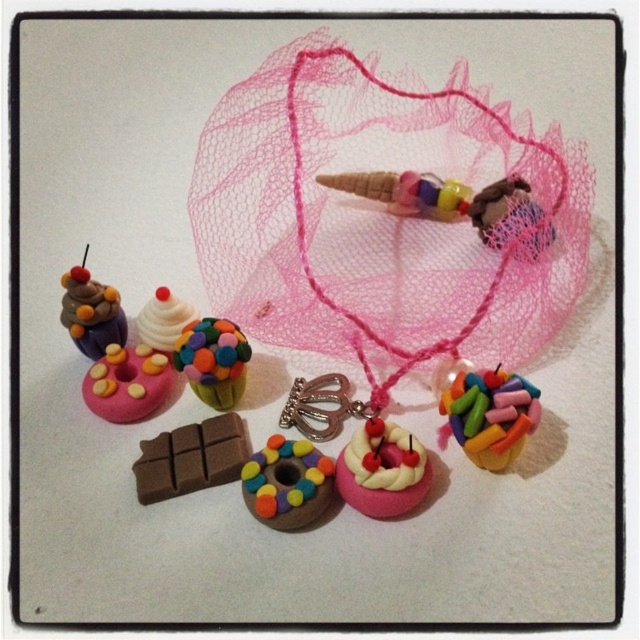
Question: Which object is farther from the camera taking this photo?

Choices:
 (A) matte brown donut at center
 (B) brown matte chocolate bar at lower left

Answer: (B)

Question: Can you confirm if matte brown donut at center is positioned to the right of matte chocolate cupcake at left?

Choices:
 (A) no
 (B) yes

Answer: (B)

Question: Is brown matte chocolate bar at lower left behind pink matte donut at center-left?

Choices:
 (A) no
 (B) yes

Answer: (A)

Question: Which object is the farthest from the multicolored clay candy at center?

Choices:
 (A) brown matte chocolate bar at lower left
 (B) matte chocolate cupcake at left

Answer: (B)

Question: Which object appears farthest from the camera in this image?

Choices:
 (A) matte pink cupcake with colorful sprinkles at center
 (B) brown matte chocolate bar at lower left
 (C) multicolored clay candy at center

Answer: (B)

Question: Is matte pink cupcake with colorful sprinkles at center wider than pink matte donut at center-left?

Choices:
 (A) yes
 (B) no

Answer: (A)